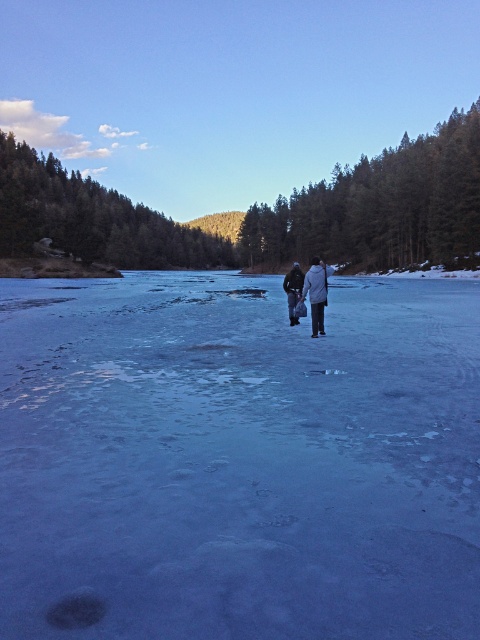
Question: Can you confirm if white woolen coat at center is wider than dark gray jacket at center?

Choices:
 (A) yes
 (B) no

Answer: (A)

Question: Can you confirm if blue ice at center is smaller than white woolen coat at center?

Choices:
 (A) yes
 (B) no

Answer: (B)

Question: Which of the following is the farthest from the observer?

Choices:
 (A) white woolen coat at center
 (B) dark gray jacket at center

Answer: (B)

Question: Which of the following is the closest to the observer?

Choices:
 (A) [290, 280]
 (B) [101, 481]

Answer: (B)

Question: Does blue ice at center have a smaller size compared to white woolen coat at center?

Choices:
 (A) no
 (B) yes

Answer: (A)

Question: Among these objects, which one is nearest to the camera?

Choices:
 (A) blue ice at center
 (B) dark gray jacket at center

Answer: (A)